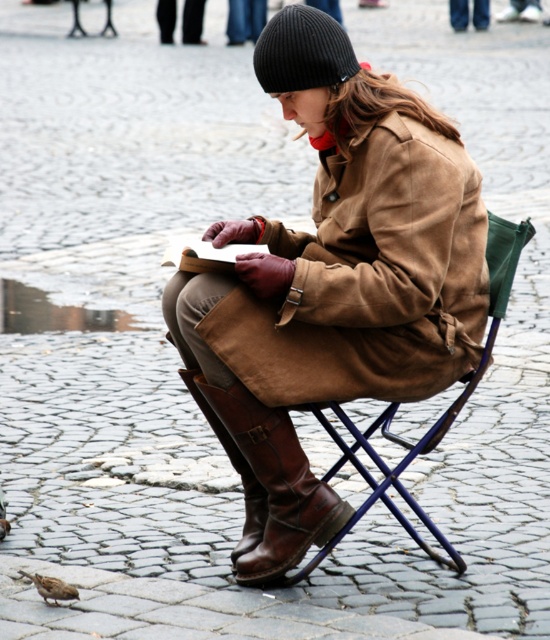
Question: Which object is closer to the camera taking this photo?

Choices:
 (A) brown feathered pigeon at lower left
 (B) brown suede coat at center

Answer: (A)

Question: Which object is farther from the camera taking this photo?

Choices:
 (A) black knit beanie at upper center
 (B) brown leather boot at lower center

Answer: (B)

Question: In this image, where is brown suede coat at center located relative to blue metal folding chair at center?

Choices:
 (A) right
 (B) left

Answer: (B)

Question: Where is blue metal folding chair at center located in relation to brown feathered pigeon at lower left in the image?

Choices:
 (A) left
 (B) right

Answer: (B)

Question: Is brown suede coat at center positioned behind blue metal folding chair at center?

Choices:
 (A) no
 (B) yes

Answer: (A)

Question: Which point is closer to the camera taking this photo?

Choices:
 (A) (244, 483)
 (B) (254, 64)
 (C) (44, 579)
 (D) (490, 355)

Answer: (C)